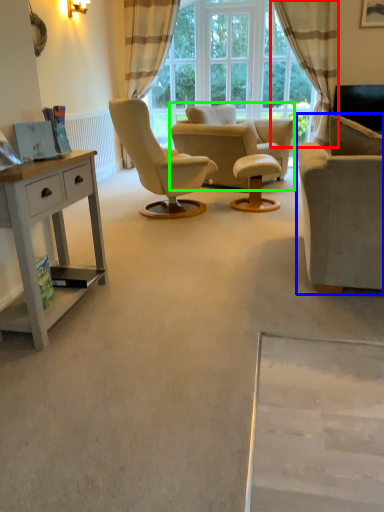
Question: Based on their relative distances, which object is farther from curtain (highlighted by a red box)? Choose from studio couch (highlighted by a blue box) and chair (highlighted by a green box).

Choices:
 (A) studio couch
 (B) chair

Answer: (A)